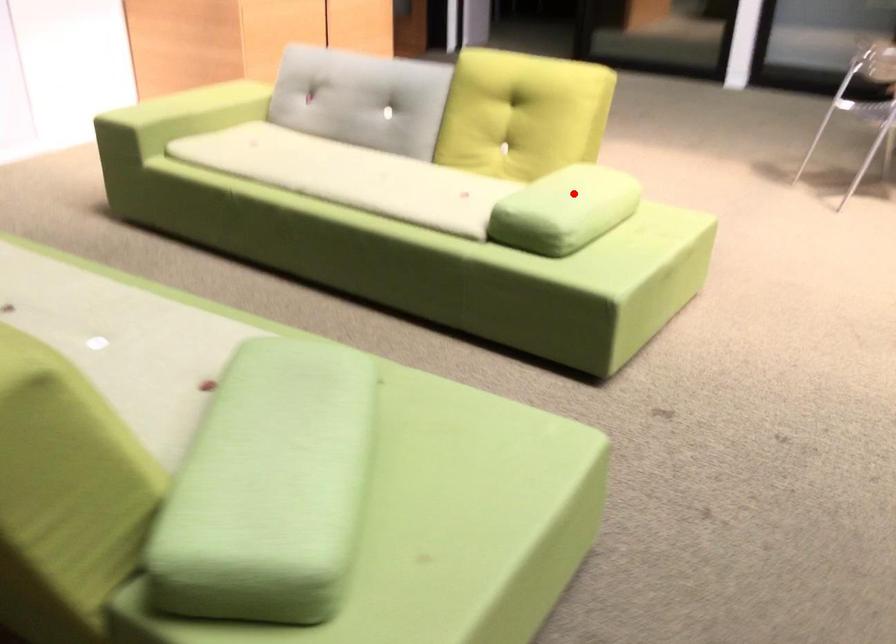
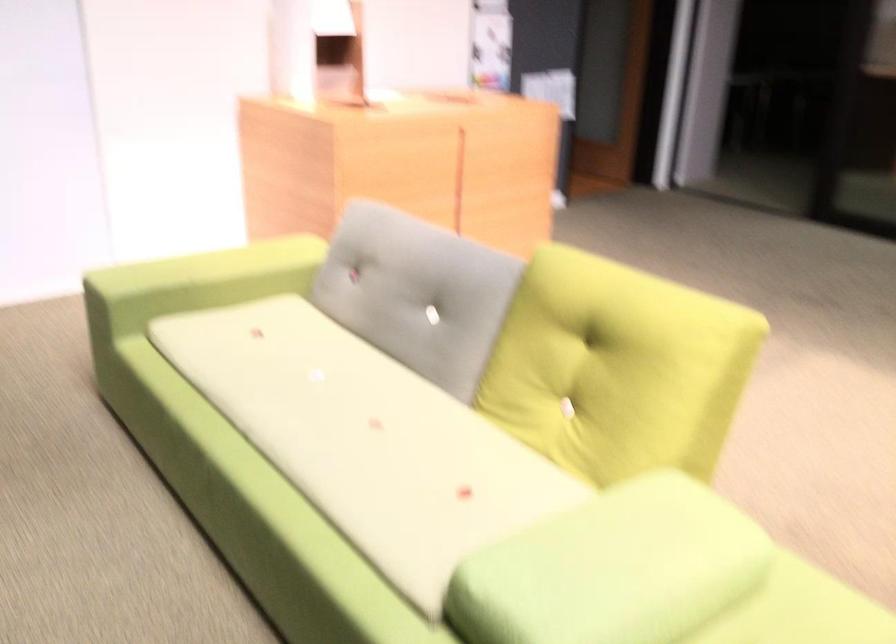
Where in the second image is the point corresponding to the highlighted location from the first image?

(613, 569)